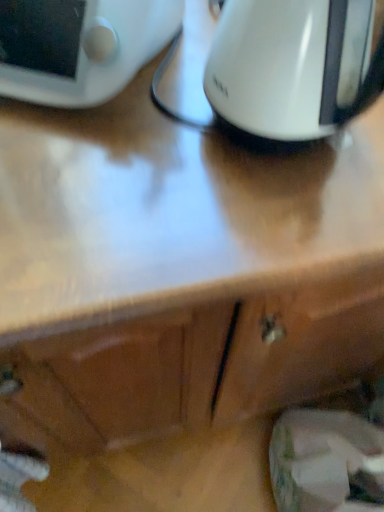
The width and height of the screenshot is (384, 512). In order to click on free spot in front of white glossy digital clock at upper left in this screenshot , I will do `click(102, 178)`.